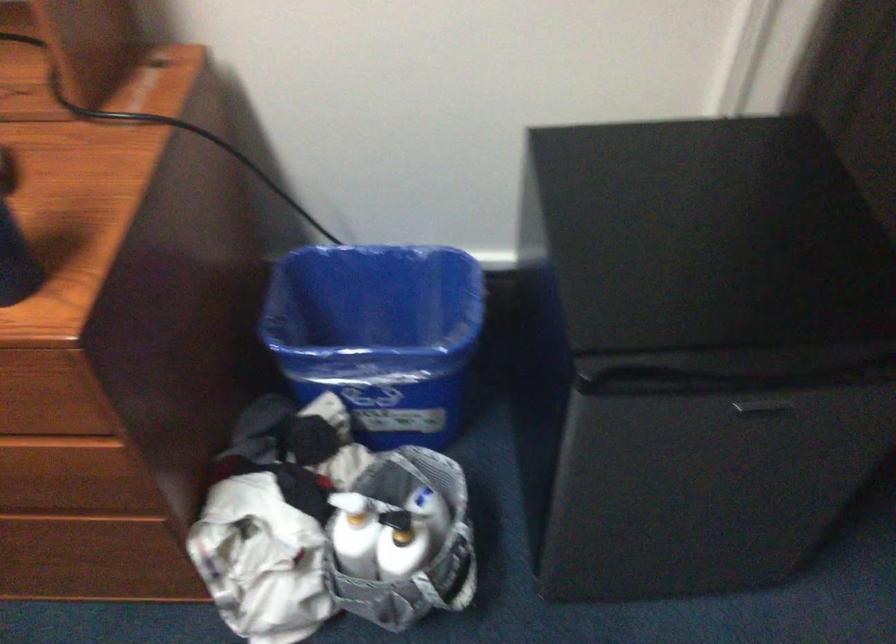
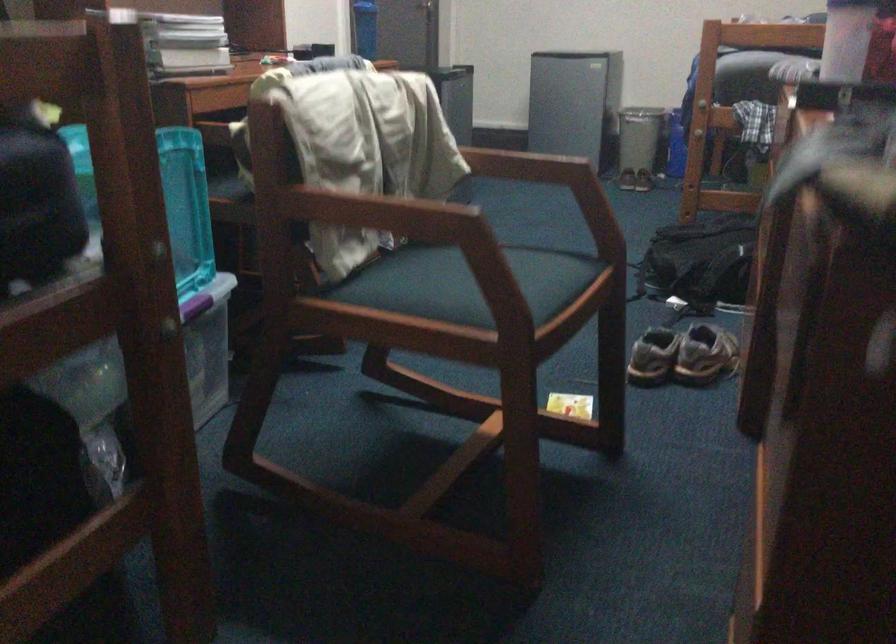
Question: I am providing you with two images of the same scene from different viewpoints. After the viewpoint changes to image2, which objects are now occluded?

Choices:
 (A) black backpack
 (B) printer control buttons
 (C) pair of sneakers
 (D) drawer handle

Answer: (D)